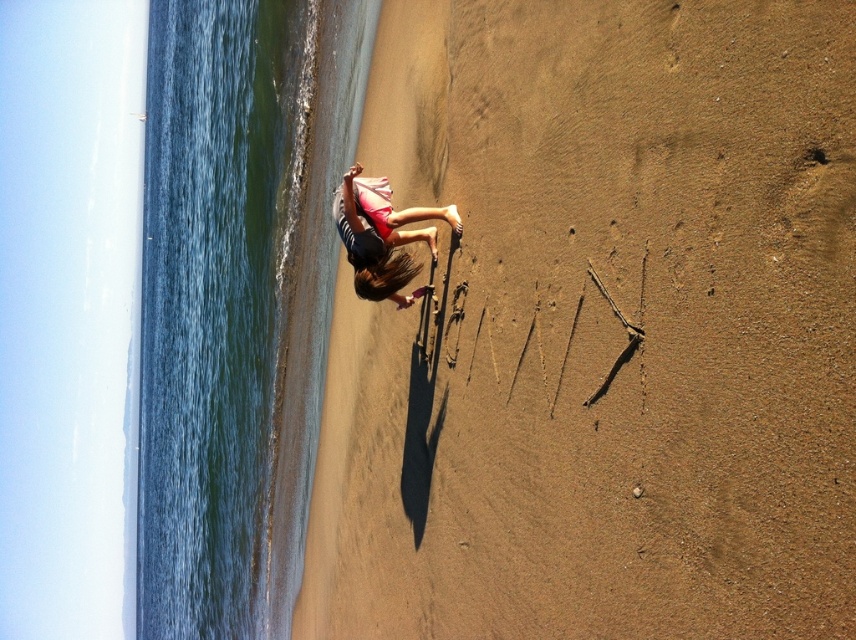
You are a photographer planning to capture a sunset shot from the beach. The brown sandy beach at lower right is your primary location. Where should you position yourself relative to the shoreline to ensure the sunset is framed correctly?

The brown sandy beach at lower right is located at point coordinates, so you should position yourself near the shoreline on the left side to frame the sunset properly.

You are planning to build a sandcastle on the beach. Considering the space available between the brown sandy beach at lower right and the blue water at left, which area would be more suitable for building a larger sandcastle?

The blue water at left occupies more space than the brown sandy beach at lower right, so building a larger sandcastle would be more suitable in the blue water at left.